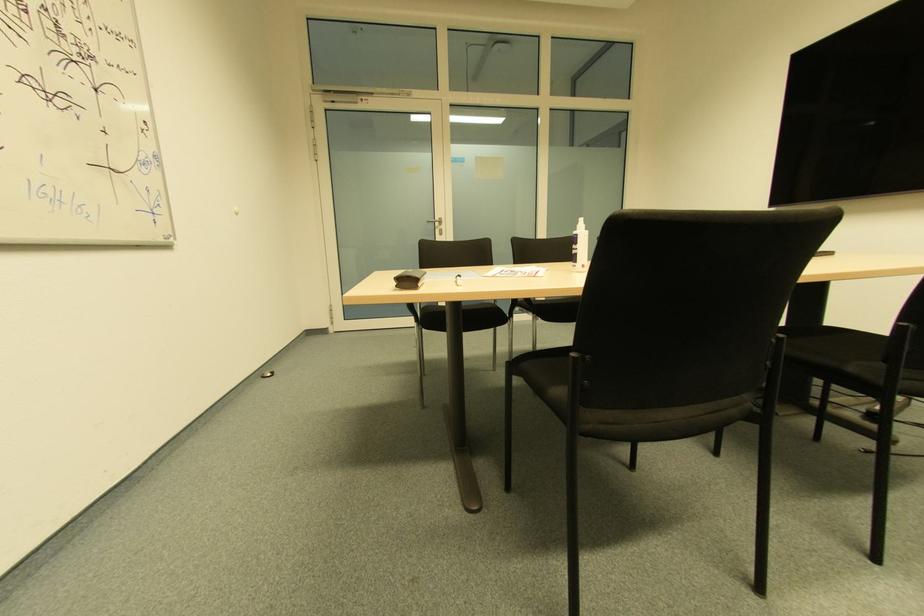
Where is `silver door handle`? silver door handle is located at coordinates (436, 225).